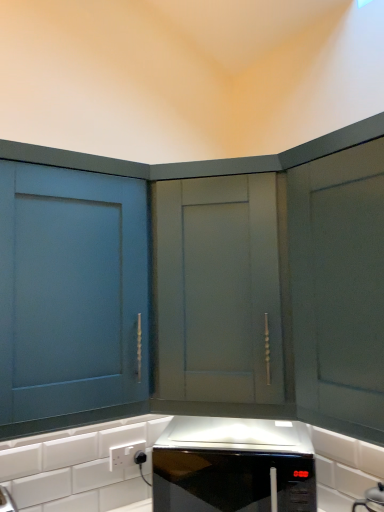
Identify the location of matte blue cabinet at left, which ranks as the first cabinetry in left-to-right order. point(71,291).

The height and width of the screenshot is (512, 384). Describe the element at coordinates (204, 161) in the screenshot. I see `matte gray cabinet at center, which appears as the 1th cabinetry when viewed from the right` at that location.

The width and height of the screenshot is (384, 512). What do you see at coordinates (127, 455) in the screenshot?
I see `white plastic electric outlet at lower center` at bounding box center [127, 455].

Locate an element on the screen. matte blue cabinet at left, which is counted as the 2th cabinetry, starting from the right is located at coordinates (71, 291).

Does white plastic electric outlet at lower center turn towards black glossy microwave at center?

Yes, white plastic electric outlet at lower center is turned towards black glossy microwave at center.

Which of these two, white plastic electric outlet at lower center or black glossy microwave at center, is wider?

With larger width is black glossy microwave at center.

The image size is (384, 512). Find the location of `electric outlet located below the black glossy microwave at center (from the image's perspective)`. electric outlet located below the black glossy microwave at center (from the image's perspective) is located at coordinates pos(127,455).

Considering the positions of point (139, 462) and point (211, 500), is point (139, 462) closer or farther from the camera than point (211, 500)?

Point (139, 462).

From the image's perspective, who appears lower, black glossy microwave at center or matte blue cabinet at left, which ranks as the first cabinetry in left-to-right order?

black glossy microwave at center appears lower in the image.

Considering the relative positions of black glossy microwave at center and matte blue cabinet at left, which ranks as the first cabinetry in left-to-right order, in the image provided, is black glossy microwave at center to the right of matte blue cabinet at left, which ranks as the first cabinetry in left-to-right order, from the viewer's perspective?

Indeed, black glossy microwave at center is positioned on the right side of matte blue cabinet at left, which ranks as the first cabinetry in left-to-right order.

From a real-world perspective, which is physically below, black glossy microwave at center or matte blue cabinet at left, which ranks as the first cabinetry in left-to-right order?

black glossy microwave at center.

Which point is more forward, (190,417) or (28,313)?

The point (28,313) is more forward.

Consider the image. Does black glossy microwave at center have a greater height compared to matte gray cabinet at center, which appears as the 1th cabinetry when viewed from the right?

In fact, black glossy microwave at center may be shorter than matte gray cabinet at center, which appears as the 1th cabinetry when viewed from the right.

Does black glossy microwave at center have a larger size compared to matte gray cabinet at center, which appears as the 1th cabinetry when viewed from the right?

No.

Is point (183, 461) farther from viewer compared to point (285, 288)?

Yes.

Could you measure the distance between black glossy microwave at center and matte gray cabinet at center, which appears as the 1th cabinetry when viewed from the right?

They are 14.19 inches apart.

Does matte gray cabinet at center, which appears as the 1th cabinetry when viewed from the right, contain white plastic electric outlet at lower center?

Definitely not — white plastic electric outlet at lower center is not inside matte gray cabinet at center, which appears as the 1th cabinetry when viewed from the right.

In the scene shown: Relative to white plastic electric outlet at lower center, is matte gray cabinet at center, placed as the second cabinetry when sorted from left to right, in front or behind?

In the image, matte gray cabinet at center, placed as the second cabinetry when sorted from left to right, appears in front of white plastic electric outlet at lower center.

Can you confirm if matte gray cabinet at center, which appears as the 1th cabinetry when viewed from the right, is positioned to the right of white plastic electric outlet at lower center?

Yes, matte gray cabinet at center, which appears as the 1th cabinetry when viewed from the right, is to the right of white plastic electric outlet at lower center.

From a real-world perspective, is matte gray cabinet at center, which appears as the 1th cabinetry when viewed from the right, under white plastic electric outlet at lower center?

No, from a real-world perspective, matte gray cabinet at center, which appears as the 1th cabinetry when viewed from the right, is not beneath white plastic electric outlet at lower center.

Could you measure the distance between matte blue cabinet at left, which ranks as the first cabinetry in left-to-right order, and matte gray cabinet at center, which appears as the 1th cabinetry when viewed from the right?

matte blue cabinet at left, which ranks as the first cabinetry in left-to-right order, is 8.36 inches from matte gray cabinet at center, which appears as the 1th cabinetry when viewed from the right.

From a real-world perspective, is matte blue cabinet at left, which is counted as the 2th cabinetry, starting from the right, on matte gray cabinet at center, which appears as the 1th cabinetry when viewed from the right?

Yes, from a real-world perspective, matte blue cabinet at left, which is counted as the 2th cabinetry, starting from the right, is over matte gray cabinet at center, which appears as the 1th cabinetry when viewed from the right

Considering the relative sizes of matte blue cabinet at left, which ranks as the first cabinetry in left-to-right order, and matte gray cabinet at center, placed as the second cabinetry when sorted from left to right, in the image provided, is matte blue cabinet at left, which ranks as the first cabinetry in left-to-right order, shorter than matte gray cabinet at center, placed as the second cabinetry when sorted from left to right,?

Correct, matte blue cabinet at left, which ranks as the first cabinetry in left-to-right order, is not as tall as matte gray cabinet at center, placed as the second cabinetry when sorted from left to right.

Between matte blue cabinet at left, which ranks as the first cabinetry in left-to-right order, and matte gray cabinet at center, placed as the second cabinetry when sorted from left to right, which one has smaller size?

With smaller size is matte blue cabinet at left, which ranks as the first cabinetry in left-to-right order.

In terms of size, does matte blue cabinet at left, which ranks as the first cabinetry in left-to-right order, appear bigger or smaller than white plastic electric outlet at lower center?

In the image, matte blue cabinet at left, which ranks as the first cabinetry in left-to-right order, appears to be larger than white plastic electric outlet at lower center.

Can you tell me how much matte blue cabinet at left, which is counted as the 2th cabinetry, starting from the right, and white plastic electric outlet at lower center differ in facing direction?

They differ by 2.34 degrees in their facing directions.

Is matte blue cabinet at left, which is counted as the 2th cabinetry, starting from the right, positioned in front of white plastic electric outlet at lower center?

Yes, it is in front of white plastic electric outlet at lower center.

Does white plastic electric outlet at lower center touch matte gray cabinet at center, which appears as the 1th cabinetry when viewed from the right?

white plastic electric outlet at lower center is not next to matte gray cabinet at center, which appears as the 1th cabinetry when viewed from the right, and they're not touching.

Does point (132, 453) come farther from viewer compared to point (85, 170)?

That is True.

In the scene shown: Does white plastic electric outlet at lower center come in front of matte gray cabinet at center, placed as the second cabinetry when sorted from left to right?

No, white plastic electric outlet at lower center is further to the viewer.

Is white plastic electric outlet at lower center inside the boundaries of matte gray cabinet at center, which appears as the 1th cabinetry when viewed from the right, or outside?

white plastic electric outlet at lower center is outside matte gray cabinet at center, which appears as the 1th cabinetry when viewed from the right.

The image size is (384, 512). What are the coordinates of `home appliance to the right of white plastic electric outlet at lower center` in the screenshot? It's located at (233, 466).

What are the coordinates of `cabinetry that is the 2nd object located above the black glossy microwave at center (from the image's perspective)` in the screenshot? It's located at (71, 291).

From the image, which object appears to be farther from matte blue cabinet at left, which is counted as the 2th cabinetry, starting from the right, white plastic electric outlet at lower center or black glossy microwave at center?

The object further to matte blue cabinet at left, which is counted as the 2th cabinetry, starting from the right, is white plastic electric outlet at lower center.

Considering their positions, is matte gray cabinet at center, placed as the second cabinetry when sorted from left to right, positioned further to white plastic electric outlet at lower center than matte blue cabinet at left, which is counted as the 2th cabinetry, starting from the right?

matte gray cabinet at center, placed as the second cabinetry when sorted from left to right.

Considering their positions, is white plastic electric outlet at lower center positioned further to black glossy microwave at center than matte blue cabinet at left, which ranks as the first cabinetry in left-to-right order?

The object further to black glossy microwave at center is matte blue cabinet at left, which ranks as the first cabinetry in left-to-right order.

Estimate the real-world distances between objects in this image. Which object is further from matte gray cabinet at center, which appears as the 1th cabinetry when viewed from the right, matte blue cabinet at left, which ranks as the first cabinetry in left-to-right order, or white plastic electric outlet at lower center?

white plastic electric outlet at lower center is further to matte gray cabinet at center, which appears as the 1th cabinetry when viewed from the right.

From the image, which object appears to be farther from white plastic electric outlet at lower center, black glossy microwave at center or matte blue cabinet at left, which is counted as the 2th cabinetry, starting from the right?

matte blue cabinet at left, which is counted as the 2th cabinetry, starting from the right, is positioned further to the anchor white plastic electric outlet at lower center.

When comparing their distances from matte gray cabinet at center, placed as the second cabinetry when sorted from left to right, does black glossy microwave at center or white plastic electric outlet at lower center seem further?

white plastic electric outlet at lower center is further to matte gray cabinet at center, placed as the second cabinetry when sorted from left to right.

Considering their positions, is white plastic electric outlet at lower center positioned closer to matte gray cabinet at center, which appears as the 1th cabinetry when viewed from the right, than matte blue cabinet at left, which ranks as the first cabinetry in left-to-right order?

Among the two, matte blue cabinet at left, which ranks as the first cabinetry in left-to-right order, is located nearer to matte gray cabinet at center, which appears as the 1th cabinetry when viewed from the right.

Looking at the image, which one is located closer to matte blue cabinet at left, which is counted as the 2th cabinetry, starting from the right, black glossy microwave at center or white plastic electric outlet at lower center?

black glossy microwave at center.

Locate an element on the screen. This screenshot has width=384, height=512. home appliance between matte blue cabinet at left, which ranks as the first cabinetry in left-to-right order, and white plastic electric outlet at lower center, in the vertical direction is located at coordinates (233, 466).

Identify the location of cabinetry that lies between matte blue cabinet at left, which ranks as the first cabinetry in left-to-right order, and black glossy microwave at center from top to bottom. The height and width of the screenshot is (512, 384). (204, 161).

Where is `cabinetry between matte blue cabinet at left, which ranks as the first cabinetry in left-to-right order, and white plastic electric outlet at lower center, in the vertical direction`? cabinetry between matte blue cabinet at left, which ranks as the first cabinetry in left-to-right order, and white plastic electric outlet at lower center, in the vertical direction is located at coordinates (204, 161).

Identify the location of home appliance between matte gray cabinet at center, which appears as the 1th cabinetry when viewed from the right, and white plastic electric outlet at lower center, in the vertical direction. This screenshot has height=512, width=384. (233, 466).